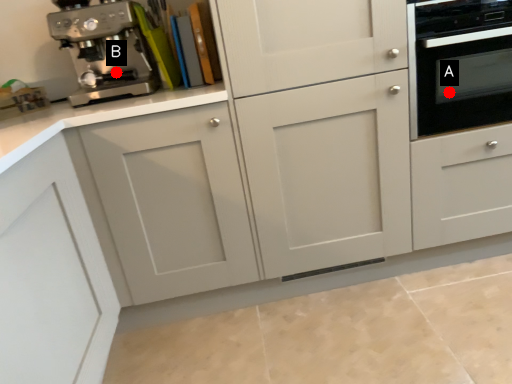
Question: Two points are circled on the image, labeled by A and B beside each circle. Which point is closer to the camera?

Choices:
 (A) A is closer
 (B) B is closer

Answer: (B)